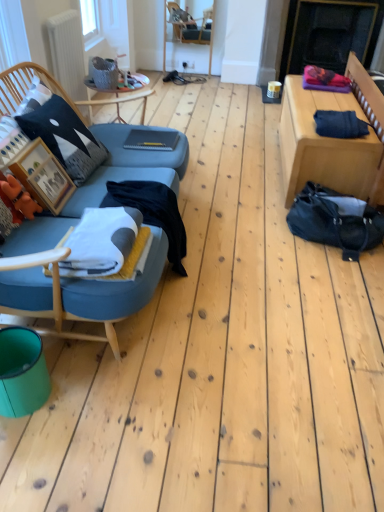
This screenshot has width=384, height=512. What do you see at coordinates (116, 98) in the screenshot?
I see `wooden tray at upper left, the 2th table when ordered from right to left` at bounding box center [116, 98].

Describe the element at coordinates (22, 372) in the screenshot. I see `teal plastic bin at lower left` at that location.

Locate an element on the screen. This screenshot has height=512, width=384. white soft blanket at center is located at coordinates (103, 243).

What is the approximate height of orange plush toy at lower left?

10.19 inches.

Image resolution: width=384 pixels, height=512 pixels. Find the location of `denim fabric at right, the second table in the left-to-right sequence`. denim fabric at right, the second table in the left-to-right sequence is located at coordinates [x=323, y=145].

What do you see at coordinates (330, 34) in the screenshot? I see `black matte fireplace at upper right` at bounding box center [330, 34].

You are a GUI agent. You are given a task and a screenshot of the screen. Output one action in this format:
    pyautogui.click(x=<x>, y=<y>)
    Task: Click on the wooden tray at upper left, the 1th table when ordered from left to right
    
    Given the screenshot: What is the action you would take?
    pyautogui.click(x=116, y=98)

Is wooden tray at upper left, the 1th table when ordered from left to right, closer to camera compared to denim fabric at right, acting as the first table starting from the right?

No, it is not.

Are wooden tray at upper left, the 1th table when ordered from left to right, and denim fabric at right, acting as the first table starting from the right, making contact?

No, wooden tray at upper left, the 1th table when ordered from left to right, is not with denim fabric at right, acting as the first table starting from the right.

What's the angular difference between wooden tray at upper left, the 2th table when ordered from right to left, and denim fabric at right, acting as the first table starting from the right,'s facing directions?

They differ by 179 degrees in their facing directions.

Consider the image. Is denim fabric at right, the second table in the left-to-right sequence, completely or partially inside wooden tray at upper left, the 1th table when ordered from left to right?

No.

Between white soft blanket at center and teal plastic bin at lower left, which one appears on the left side from the viewer's perspective?

teal plastic bin at lower left is more to the left.

Based on their sizes in the image, would you say white soft blanket at center is bigger or smaller than teal plastic bin at lower left?

white soft blanket at center is smaller than teal plastic bin at lower left.

Is white soft blanket at center inside the boundaries of teal plastic bin at lower left, or outside?

white soft blanket at center cannot be found inside teal plastic bin at lower left.

Considering the relative sizes of white soft blanket at center and teal plastic bin at lower left in the image provided, is white soft blanket at center shorter than teal plastic bin at lower left?

Indeed, white soft blanket at center has a lesser height compared to teal plastic bin at lower left.

Between white matte radiator at upper left and orange plush toy at lower left, which one has less height?

Standing shorter between the two is orange plush toy at lower left.

Is white matte radiator at upper left looking in the opposite direction of orange plush toy at lower left?

No, white matte radiator at upper left is not facing away from orange plush toy at lower left.

Looking at the image, does white matte radiator at upper left seem bigger or smaller compared to orange plush toy at lower left?

Considering their sizes, white matte radiator at upper left takes up more space than orange plush toy at lower left.

Between white matte radiator at upper left and orange plush toy at lower left, which one appears on the right side from the viewer's perspective?

orange plush toy at lower left.

From the image's perspective, which is below, white matte radiator at upper left or black matte fireplace at upper right?

white matte radiator at upper left.

Considering the points (59, 38) and (377, 6), which point is in front, point (59, 38) or point (377, 6)?

Point (59, 38)

From the picture: Is white matte radiator at upper left aimed at black matte fireplace at upper right?

No, white matte radiator at upper left is not turned towards black matte fireplace at upper right.

Is wooden chair at center turned away from wooden picture frame at left?

No, wooden chair at center's orientation is not away from wooden picture frame at left.

Which object is positioned more to the left, wooden chair at center or wooden picture frame at left?

From the viewer's perspective, wooden picture frame at left appears more on the left side.

Is wooden chair at center directly adjacent to wooden picture frame at left?

No, wooden chair at center is not touching wooden picture frame at left.

Measure the distance between wooden chair at center and wooden picture frame at left.

The distance of wooden chair at center from wooden picture frame at left is 3.64 meters.

At what (x,y) coordinates should I click in order to perform the action: click on table that is the 1st one when counting rightward from the matte black pillow at left. Please return your answer as a coordinate pair (x, y). The width and height of the screenshot is (384, 512). Looking at the image, I should click on (116, 98).

Looking at this image, does wooden tray at upper left, the 2th table when ordered from right to left, have a greater height compared to matte black pillow at left?

In fact, wooden tray at upper left, the 2th table when ordered from right to left, may be shorter than matte black pillow at left.

Visually, is wooden tray at upper left, the 2th table when ordered from right to left, positioned to the left or to the right of matte black pillow at left?

wooden tray at upper left, the 2th table when ordered from right to left, is to the right of matte black pillow at left.

Considering their positions, is wooden tray at upper left, the 2th table when ordered from right to left, located in front of or behind matte black pillow at left?

wooden tray at upper left, the 2th table when ordered from right to left, is behind matte black pillow at left.

From the picture: Is wooden picture frame at left bigger than wooden chair at center?

Incorrect, wooden picture frame at left is not larger than wooden chair at center.

Is wooden chair at center located within wooden picture frame at left?

No, wooden picture frame at left does not contain wooden chair at center.

This screenshot has width=384, height=512. Find the location of `picture frame above the wooden chair at center (from a real-world perspective)`. picture frame above the wooden chair at center (from a real-world perspective) is located at coordinates (43, 176).

Would you consider wooden picture frame at left to be distant from wooden chair at center?

Yes.

At what (x,y) coordinates should I click in order to perform the action: click on table in front of the wooden tray at upper left, the 2th table when ordered from right to left. Please return your answer as a coordinate pair (x, y). This screenshot has height=512, width=384. Looking at the image, I should click on (323, 145).

Locate an element on the screen. The width and height of the screenshot is (384, 512). blanket on the right of the teal plastic bin at lower left is located at coordinates (103, 243).

Looking at the image, which one is located closer to orange plush toy at lower left, white matte radiator at upper left or wooden picture frame at left?

Based on the image, wooden picture frame at left appears to be nearer to orange plush toy at lower left.

Which object lies further to the anchor point white soft blanket at center, orange plush toy at lower left or wooden picture frame at left?

orange plush toy at lower left lies further to white soft blanket at center than the other object.

From the picture: When comparing their distances from black matte fireplace at upper right, does matte black pillow at left or denim fabric at right, acting as the first table starting from the right, seem further?

matte black pillow at left.

Estimate the real-world distances between objects in this image. Which object is further from white matte radiator at upper left, white soft blanket at center or matte black pillow at left?

white soft blanket at center is further to white matte radiator at upper left.

In the scene shown: Considering their positions, is white soft blanket at center positioned closer to wooden chair at center than white matte radiator at upper left?

white matte radiator at upper left lies closer to wooden chair at center than the other object.

Estimate the real-world distances between objects in this image. Which object is further from white matte radiator at upper left, orange plush toy at lower left or teal plastic bin at lower left?

Based on the image, teal plastic bin at lower left appears to be further to white matte radiator at upper left.

Looking at the image, which one is located closer to matte black pillow at left, wooden picture frame at left or white matte radiator at upper left?

wooden picture frame at left.

Considering their positions, is black matte fireplace at upper right positioned further to orange plush toy at lower left than wooden chair at center?

Based on the image, black matte fireplace at upper right appears to be further to orange plush toy at lower left.

I want to click on picture frame between orange plush toy at lower left and black matte fireplace at upper right in the front-back direction, so click(x=43, y=176).

Locate an element on the screen. picture frame located between orange plush toy at lower left and wooden tray at upper left, the 1th table when ordered from left to right, in the depth direction is located at coordinates (43, 176).

Locate an element on the screen. The width and height of the screenshot is (384, 512). radiator located between orange plush toy at lower left and wooden chair at center in the depth direction is located at coordinates (67, 52).

Locate an element on the screen. Image resolution: width=384 pixels, height=512 pixels. picture frame between matte black pillow at left and white soft blanket at center in the vertical direction is located at coordinates (43, 176).